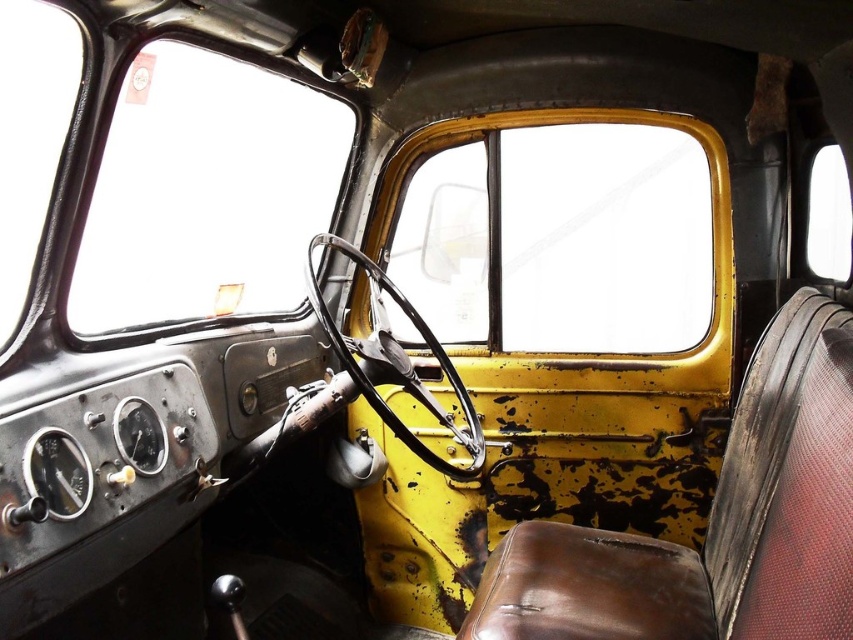
Question: Which point is closer to the camera?

Choices:
 (A) clear glass window at upper left
 (B) transparent glass window at upper right

Answer: (A)

Question: Estimate the real-world distances between objects in this image. Which object is closer to the transparent glass window at upper right?

Choices:
 (A) clear glass window at upper left
 (B) yellow metallic window at center

Answer: (B)

Question: Is clear glass window at upper left to the right of transparent glass window at upper right from the viewer's perspective?

Choices:
 (A) no
 (B) yes

Answer: (A)

Question: Does yellow metallic window at center appear over clear glass window at upper left?

Choices:
 (A) no
 (B) yes

Answer: (A)

Question: Does yellow metallic window at center appear under transparent glass window at upper right?

Choices:
 (A) no
 (B) yes

Answer: (B)

Question: Which object appears farthest from the camera in this image?

Choices:
 (A) yellow metallic window at center
 (B) transparent glass window at upper right

Answer: (A)